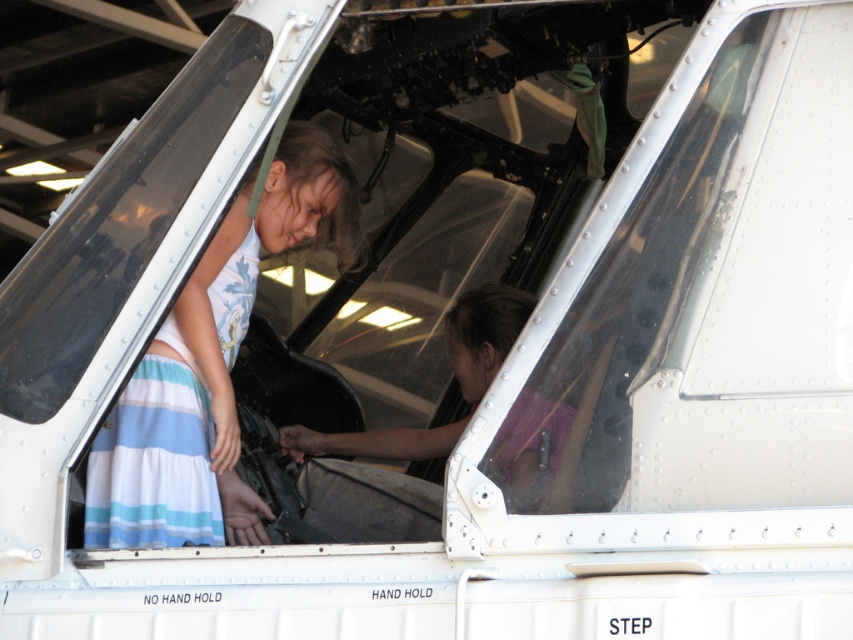
Question: Is striped cotton dress at center closer to camera compared to pink matte shirt at center?

Choices:
 (A) no
 (B) yes

Answer: (B)

Question: Which of the following is the farthest from the observer?

Choices:
 (A) striped cotton dress at center
 (B) striped cotton dress at lower left

Answer: (B)

Question: Is striped cotton dress at lower left in front of pink matte shirt at center?

Choices:
 (A) yes
 (B) no

Answer: (A)

Question: Is striped cotton dress at lower left bigger than pink matte shirt at center?

Choices:
 (A) no
 (B) yes

Answer: (B)

Question: Which of these objects is positioned farthest from the striped cotton dress at lower left?

Choices:
 (A) striped cotton dress at center
 (B) pink matte shirt at center

Answer: (B)

Question: Estimate the real-world distances between objects in this image. Which object is farther from the striped cotton dress at center?

Choices:
 (A) striped cotton dress at lower left
 (B) pink matte shirt at center

Answer: (B)